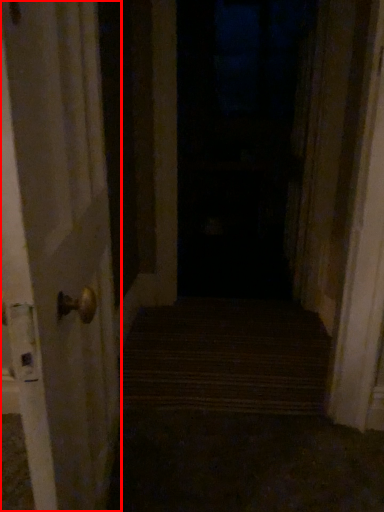
Question: From the image's perspective, where is door (annotated by the red box) located relative to window?

Choices:
 (A) above
 (B) below

Answer: (B)